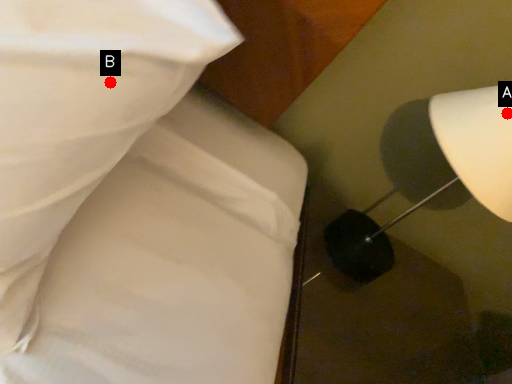
Question: Two points are circled on the image, labeled by A and B beside each circle. Which of the following is the farthest from the observer?

Choices:
 (A) A is further
 (B) B is further

Answer: (A)